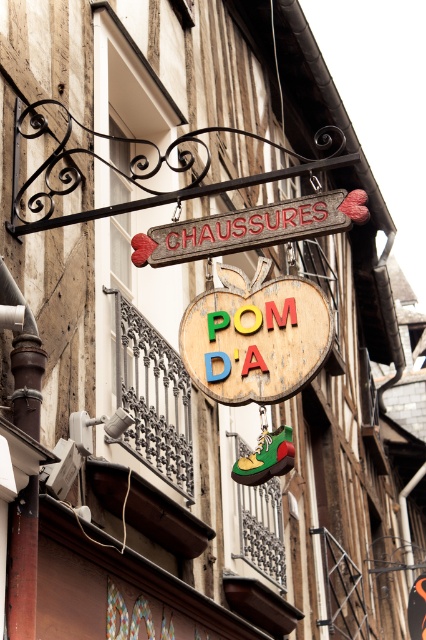
Question: Is wooden sign at center positioned behind wooden signboard at center?

Choices:
 (A) no
 (B) yes

Answer: (B)

Question: Which point is farther from the camera taking this photo?

Choices:
 (A) (290, 225)
 (B) (256, 333)

Answer: (A)

Question: Which of the following is the farthest from the observer?

Choices:
 (A) (301, 385)
 (B) (290, 211)

Answer: (B)

Question: Where is wooden sign at center located in relation to wooden signboard at center in the image?

Choices:
 (A) below
 (B) above

Answer: (A)

Question: Does wooden sign at center have a lesser width compared to wooden signboard at center?

Choices:
 (A) yes
 (B) no

Answer: (A)

Question: Among these objects, which one is nearest to the camera?

Choices:
 (A) wooden sign at center
 (B) wooden signboard at center

Answer: (B)